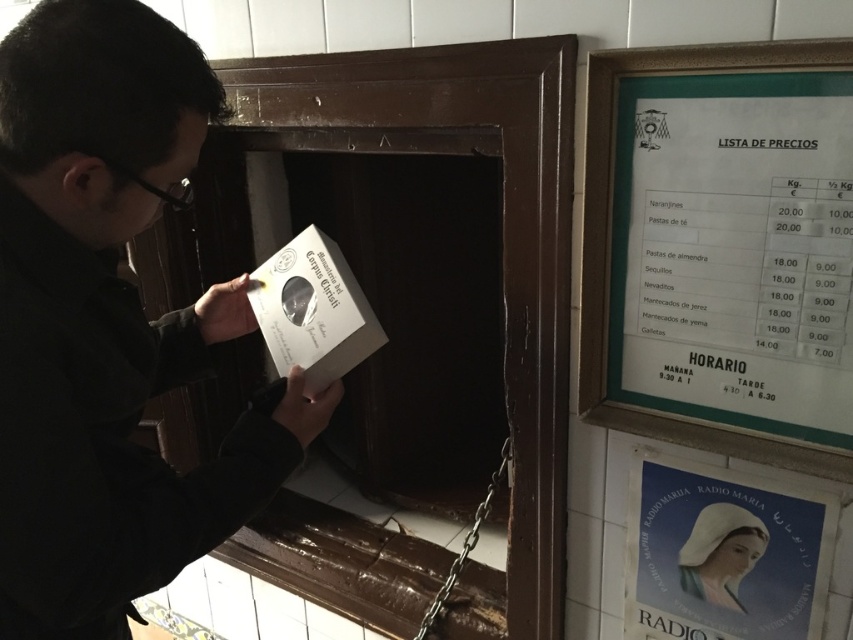
You are a delivery person trying to deliver a package to the address shown in the image. The package is 30 cm wide. The delivery instructions say you can only leave the package if there is enough space next to the black matte jacket at center and the green cardboard sign at upper right. Can you leave the package there?

The black matte jacket at center might be wider than green cardboard sign at upper right. Since the package is 30 cm wide, and the jacket could be wider than the sign, there might be enough space next to them. However, without knowing the exact width of the jacket or the sign, it is uncertain if the 30 cm package will fit. Please verify the space physically before leaving the package.

You are a customer in a store and see the black matte jacket at center and the green cardboard sign at upper right. Which item is positioned to the left of the other?

The black matte jacket at center is to the left of the green cardboard sign at upper right.